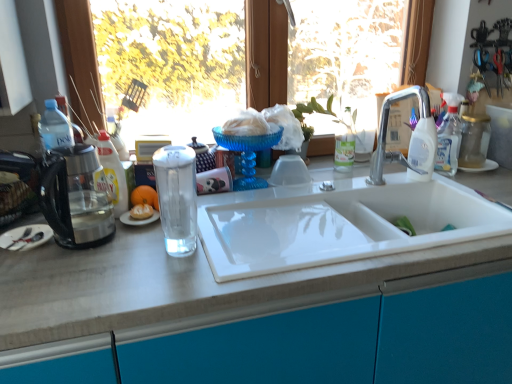
Where is `space that is in front of white matte plate at left`? This screenshot has width=512, height=384. space that is in front of white matte plate at left is located at coordinates (28, 276).